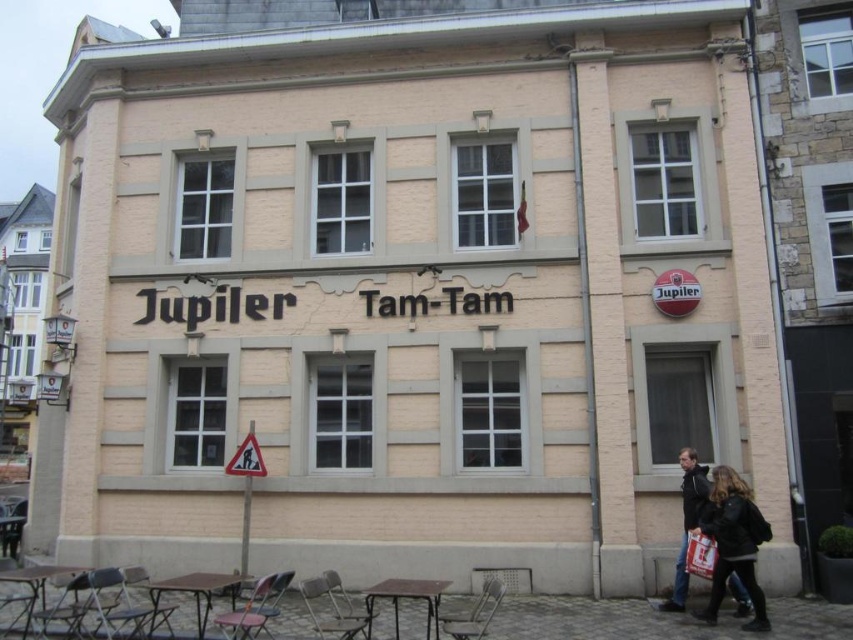
Is point (711, 621) closer to camera compared to point (692, 554)?

Yes, it is.

Which is more to the left, black leather jacket at lower right or white paper bag at lower right?

white paper bag at lower right

Does point (735, 545) lie behind point (698, 536)?

No, it is not.

Find the location of a particular element. This screenshot has height=640, width=853. black leather jacket at lower right is located at coordinates (734, 544).

Is black leather jacket at lower right shorter than dark brown leather jacket at lower right?

Indeed, black leather jacket at lower right has a lesser height compared to dark brown leather jacket at lower right.

What are the coordinates of `black leather jacket at lower right` in the screenshot? It's located at (734, 544).

Locate an element on the screen. dark brown leather jacket at lower right is located at coordinates point(688,522).

Who is more distant from viewer, (685, 531) or (693, 570)?

The point (685, 531) is behind.

Locate an element on the screen. dark brown leather jacket at lower right is located at coordinates (688, 522).

Locate an element on the screen. The width and height of the screenshot is (853, 640). dark brown leather jacket at lower right is located at coordinates (688, 522).